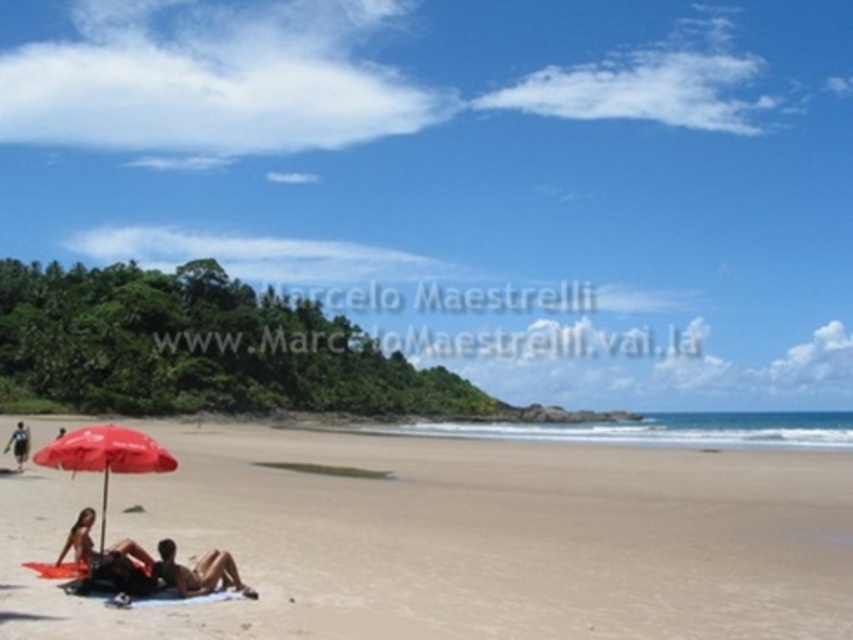
Question: Can you confirm if matte black towel at lower left is positioned below matte black bikini at lower left?

Choices:
 (A) yes
 (B) no

Answer: (B)

Question: Is matte black towel at lower left closer to the viewer compared to matte red umbrella at lower left?

Choices:
 (A) no
 (B) yes

Answer: (B)

Question: Estimate the real-world distances between objects in this image. Which object is closer to the matte red umbrella at lower left?

Choices:
 (A) dark blue fabric at lower left
 (B) matte black bikini at lower left

Answer: (B)

Question: Based on their relative distances, which object is nearer to the dark blue fabric at lower left?

Choices:
 (A) beige sand at lower left
 (B) matte black bikini at lower left
 (C) matte black towel at lower left
 (D) matte red umbrella at lower left

Answer: (D)

Question: Where is matte black towel at lower left located in relation to dark blue fabric at lower left in the image?

Choices:
 (A) above
 (B) below

Answer: (A)

Question: Which point is farther to the camera?

Choices:
 (A) beige sand at lower left
 (B) dark blue fabric at lower left

Answer: (B)